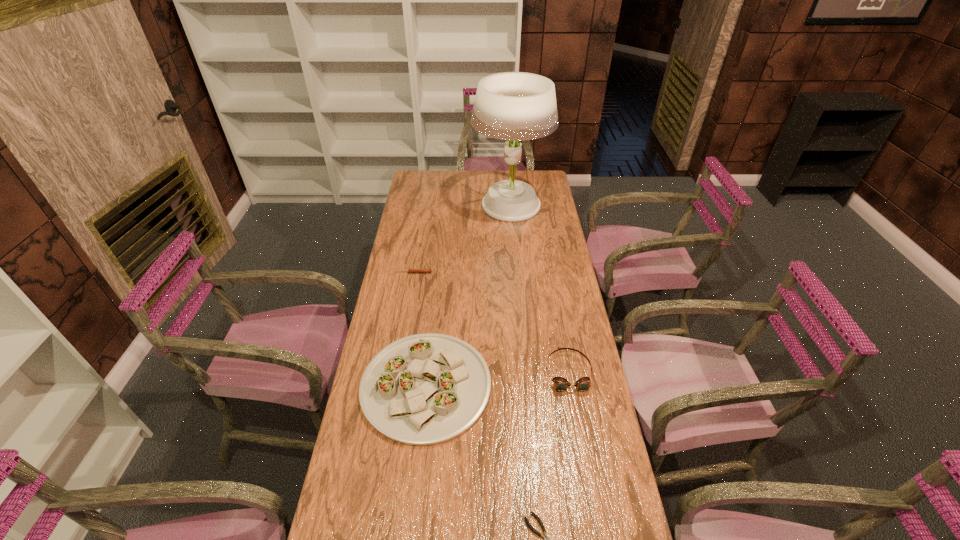
Image resolution: width=960 pixels, height=540 pixels. Identify the location of vacant space at the far left corner of the desktop. (426, 179).

What are the coordinates of `free point between the platter and the goggles` in the screenshot? It's located at (497, 379).

This screenshot has width=960, height=540. Find the location of `blank region between the goggles and the tallest object`. blank region between the goggles and the tallest object is located at coordinates (539, 288).

The width and height of the screenshot is (960, 540). Find the location of `vacant area between the second tallest object and the fourth nearest object`. vacant area between the second tallest object and the fourth nearest object is located at coordinates (420, 329).

This screenshot has width=960, height=540. Find the location of `unoccupied area between the goggles and the fourth shortest object`. unoccupied area between the goggles and the fourth shortest object is located at coordinates (497, 379).

You are a GUI agent. You are given a task and a screenshot of the screen. Output one action in this format:
    pyautogui.click(x=<x>, y=<y>)
    Task: Click on the object that is the fourth closest to the farthest object
    The width and height of the screenshot is (960, 540).
    Given the screenshot: What is the action you would take?
    pyautogui.click(x=546, y=538)

Locate which object ranks in proximity to the second tallest object. Please provide its 2D coordinates. Your answer should be formatted as a tuple, i.e. [(x, y)], where the tuple contains the x and y coordinates of a point satisfying the conditions above.

[(560, 384)]